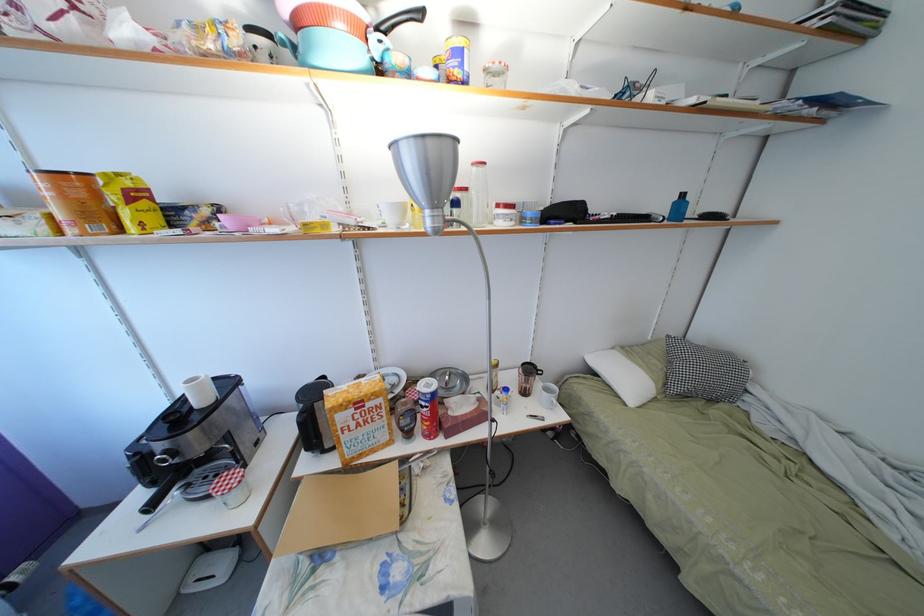
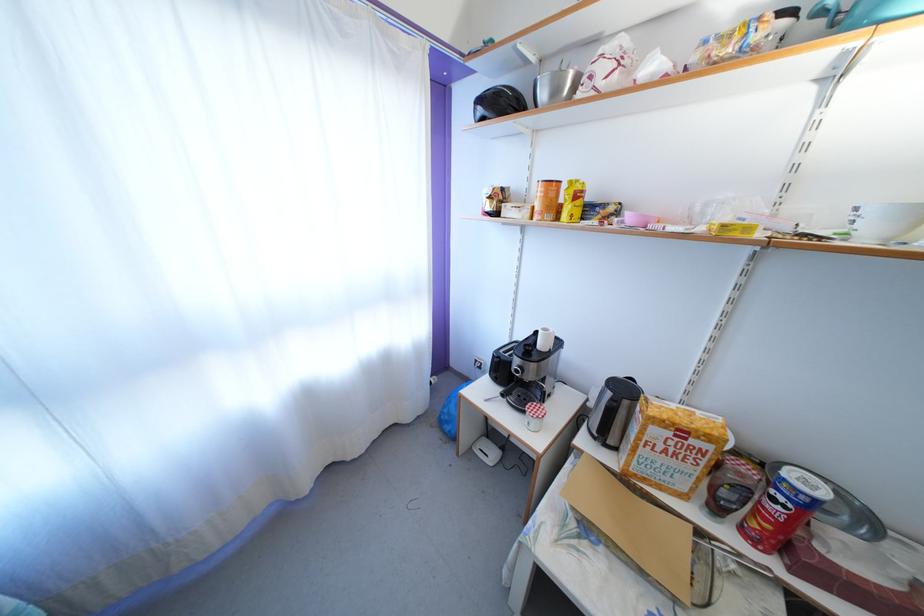
In the second image, find the point that corresponds to pixel 317 385 in the first image.

(626, 379)